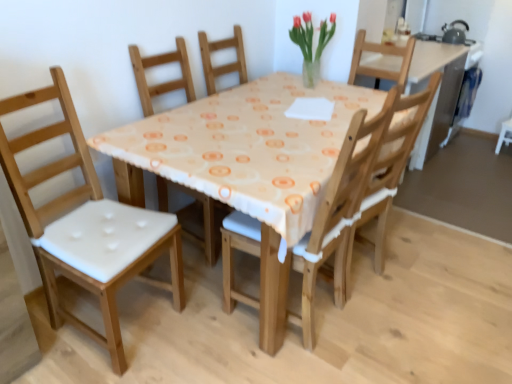
Question: From the image's perspective, is white fabric chair at left, the 1th chair when ordered from left to right, located above or below translucent glass vase at upper center?

Choices:
 (A) below
 (B) above

Answer: (A)

Question: From a real-world perspective, is white fabric chair at left, the 2th chair viewed from the right, positioned above or below translucent glass vase at upper center?

Choices:
 (A) above
 (B) below

Answer: (B)

Question: Estimate the real-world distances between objects in this image. Which object is farther from the white fabric chair at left, the 2th chair viewed from the right?

Choices:
 (A) translucent glass vase at upper center
 (B) wooden chair with white cushion at center, arranged as the 2th chair when viewed from the left

Answer: (A)

Question: Considering the real-world distances, which object is closest to the white fabric chair at left, the 1th chair when ordered from left to right?

Choices:
 (A) wooden chair with white cushion at center, positioned as the 1th chair in right-to-left order
 (B) translucent glass vase at upper center

Answer: (A)